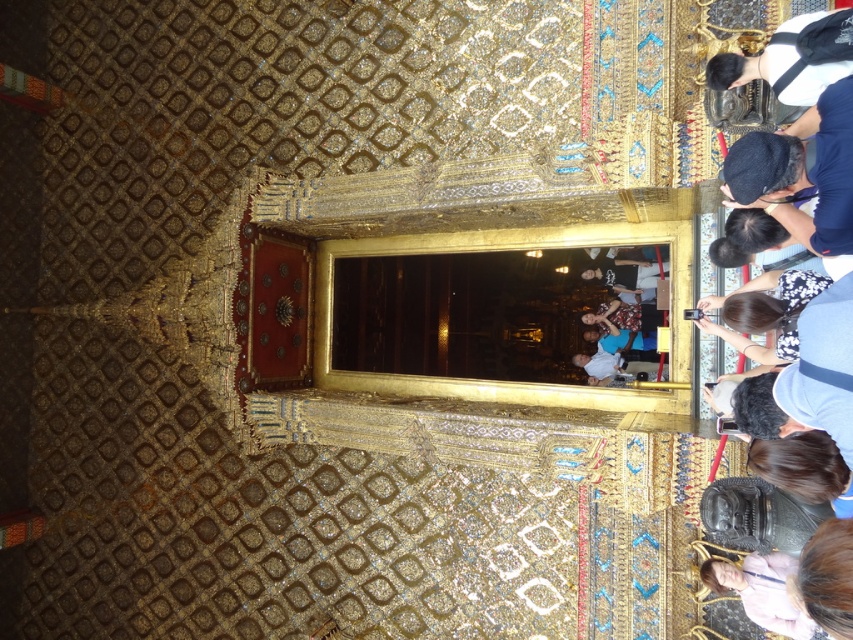
Question: Which point is farther from the camera taking this photo?

Choices:
 (A) (751, 136)
 (B) (795, 618)

Answer: (A)

Question: Does black fabric cap at upper right have a lesser width compared to pink fabric at lower right?

Choices:
 (A) no
 (B) yes

Answer: (A)

Question: Where is black fabric cap at upper right located in relation to pink fabric at lower right in the image?

Choices:
 (A) below
 (B) above

Answer: (B)

Question: Is black fabric cap at upper right closer to the viewer compared to pink fabric at lower right?

Choices:
 (A) yes
 (B) no

Answer: (A)

Question: Which of the following is the closest to the observer?

Choices:
 (A) pink fabric at lower right
 (B) black fabric cap at upper right

Answer: (B)

Question: Which of the following is the farthest from the observer?

Choices:
 (A) black fabric cap at upper right
 (B) pink fabric at lower right

Answer: (B)